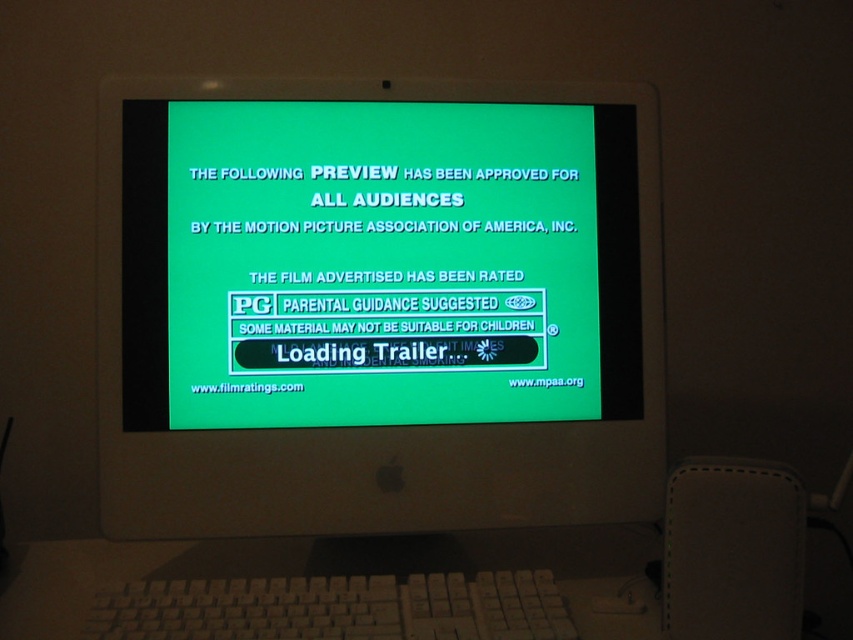
Who is taller, white plastic monitor at center or white plastic keyboard at lower center?

Standing taller between the two is white plastic monitor at center.

Does white plastic monitor at center have a larger size compared to white plastic keyboard at lower center?

Correct, white plastic monitor at center is larger in size than white plastic keyboard at lower center.

Who is more forward, (x=343, y=480) or (x=216, y=612)?

Point (x=216, y=612) is in front.

This screenshot has height=640, width=853. I want to click on white plastic monitor at center, so click(x=376, y=307).